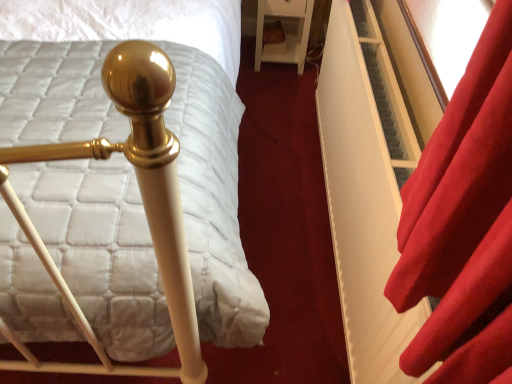
Question: Can you confirm if velvet red curtain at right is thinner than white matte bed frame at center?

Choices:
 (A) yes
 (B) no

Answer: (B)

Question: Considering the relative sizes of velvet red curtain at right and white matte bed frame at center in the image provided, is velvet red curtain at right wider than white matte bed frame at center?

Choices:
 (A) yes
 (B) no

Answer: (A)

Question: Can you confirm if velvet red curtain at right is bigger than white matte bed frame at center?

Choices:
 (A) no
 (B) yes

Answer: (A)

Question: Is velvet red curtain at right in contact with white matte bed frame at center?

Choices:
 (A) no
 (B) yes

Answer: (A)

Question: Is velvet red curtain at right to the left of white matte bed frame at center from the viewer's perspective?

Choices:
 (A) no
 (B) yes

Answer: (A)

Question: From the image's perspective, is velvet red curtain at right located above white matte bed frame at center?

Choices:
 (A) yes
 (B) no

Answer: (A)

Question: From the image's perspective, does white glossy nightstand at upper right appear lower than white quilted mattress at center?

Choices:
 (A) no
 (B) yes

Answer: (A)

Question: Is white glossy nightstand at upper right turned away from white quilted mattress at center?

Choices:
 (A) yes
 (B) no

Answer: (B)

Question: Is white glossy nightstand at upper right bigger than white quilted mattress at center?

Choices:
 (A) yes
 (B) no

Answer: (B)

Question: From a real-world perspective, is white glossy nightstand at upper right over white quilted mattress at center?

Choices:
 (A) yes
 (B) no

Answer: (B)

Question: Are white glossy nightstand at upper right and white quilted mattress at center making contact?

Choices:
 (A) yes
 (B) no

Answer: (B)

Question: Considering the relative sizes of white glossy nightstand at upper right and white quilted mattress at center in the image provided, is white glossy nightstand at upper right smaller than white quilted mattress at center?

Choices:
 (A) yes
 (B) no

Answer: (A)

Question: Does white glossy nightstand at upper right lie behind white matte bed frame at center?

Choices:
 (A) no
 (B) yes

Answer: (B)